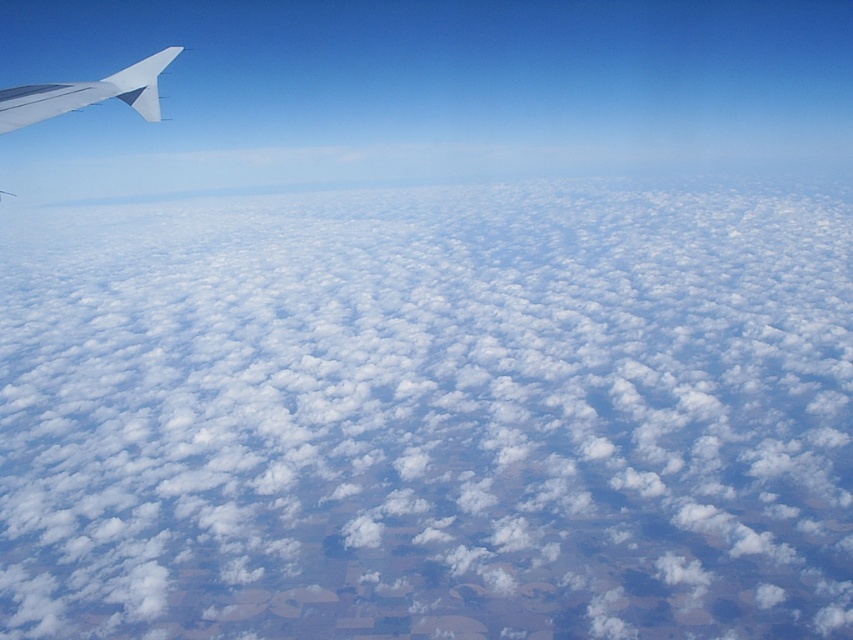
Question: Does white fluffy cloud at upper left come in front of metallic silver wing at upper left?

Choices:
 (A) yes
 (B) no

Answer: (B)

Question: Does white fluffy cloud at upper left have a greater width compared to metallic silver wing at upper left?

Choices:
 (A) yes
 (B) no

Answer: (A)

Question: Considering the relative positions of white fluffy cloud at upper left and metallic silver wing at upper left in the image provided, where is white fluffy cloud at upper left located with respect to metallic silver wing at upper left?

Choices:
 (A) below
 (B) above

Answer: (B)

Question: Which point is farther from the camera taking this photo?

Choices:
 (A) (718, 520)
 (B) (16, 116)

Answer: (A)